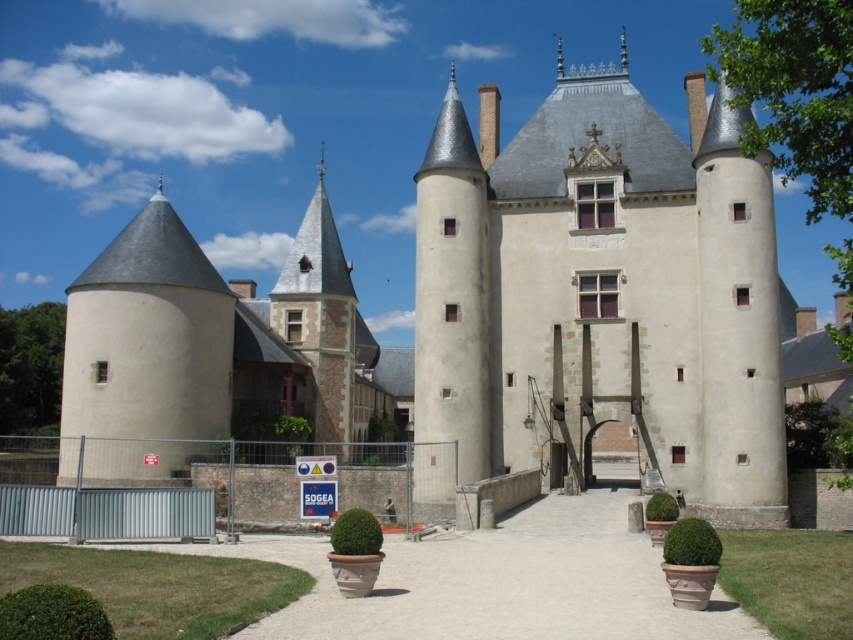
Question: Among these points, which one is nearest to the camera?

Choices:
 (A) (749, 326)
 (B) (102, 305)

Answer: (A)

Question: Which point appears closest to the camera in this image?

Choices:
 (A) (184, 467)
 (B) (720, 412)

Answer: (B)

Question: Which point is closer to the camera?

Choices:
 (A) (724, 504)
 (B) (126, 465)

Answer: (A)

Question: Does smooth beige stone tower at center have a larger size compared to smooth beige tower at left?

Choices:
 (A) yes
 (B) no

Answer: (A)

Question: Does smooth beige stone tower at center appear on the left side of smooth beige tower at left?

Choices:
 (A) no
 (B) yes

Answer: (A)

Question: Can you confirm if smooth beige stone tower at center is positioned to the left of smooth beige tower at left?

Choices:
 (A) yes
 (B) no

Answer: (B)